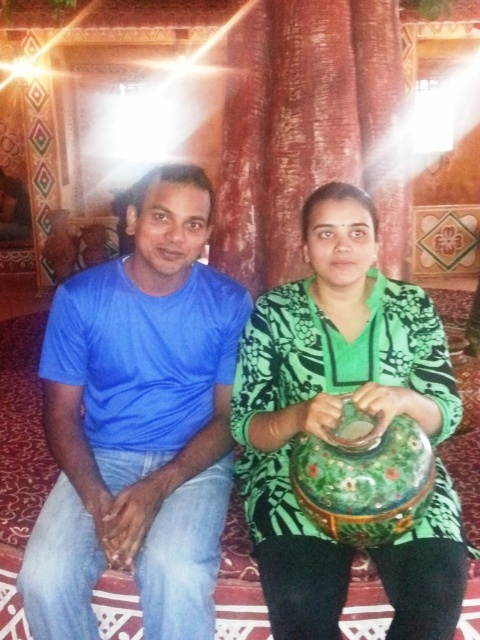
You are organizing a photo shoot and need to place a small decorative item between the blue cotton shirt at left and the green floral dress at center. Which object should the item be closer to based on their sizes?

The blue cotton shirt at left is smaller than the green floral dress at center, so the decorative item should be placed closer to the blue cotton shirt at left.